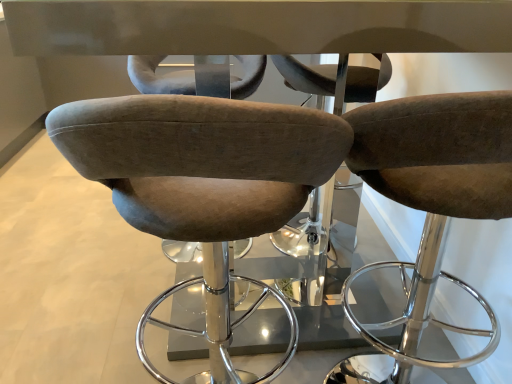
Question: Should I look upward or downward to see suede-like brown stool at center, which appears as the 1th chair when viewed from the right?

Choices:
 (A) down
 (B) up

Answer: (A)

Question: Is suede-like brown stool at center, which appears as the 1th chair when viewed from the right, shorter than velvet brown stool at center, which is the 2th chair from right to left?

Choices:
 (A) no
 (B) yes

Answer: (A)

Question: Is suede-like brown stool at center, positioned as the 2th chair in left-to-right order, not within velvet brown stool at center, which is the 2th chair from right to left?

Choices:
 (A) no
 (B) yes

Answer: (B)

Question: Is suede-like brown stool at center, positioned as the 2th chair in left-to-right order, to the left of velvet brown stool at center, the 1th chair in the left-to-right sequence, from the viewer's perspective?

Choices:
 (A) yes
 (B) no

Answer: (B)

Question: From a real-world perspective, does suede-like brown stool at center, which appears as the 1th chair when viewed from the right, stand above velvet brown stool at center, which is the 2th chair from right to left?

Choices:
 (A) no
 (B) yes

Answer: (A)

Question: Is suede-like brown stool at center, positioned as the 2th chair in left-to-right order, oriented towards velvet brown stool at center, the 1th chair in the left-to-right sequence?

Choices:
 (A) no
 (B) yes

Answer: (A)

Question: Is suede-like brown stool at center, which appears as the 1th chair when viewed from the right, positioned far away from velvet brown stool at center, which is the 2th chair from right to left?

Choices:
 (A) no
 (B) yes

Answer: (A)

Question: Considering the relative sizes of velvet brown stool at center, the 1th chair in the left-to-right sequence, and suede-like brown stool at center, which appears as the 1th chair when viewed from the right, in the image provided, is velvet brown stool at center, the 1th chair in the left-to-right sequence, thinner than suede-like brown stool at center, which appears as the 1th chair when viewed from the right,?

Choices:
 (A) yes
 (B) no

Answer: (A)

Question: Considering the relative sizes of velvet brown stool at center, which is the 2th chair from right to left, and suede-like brown stool at center, positioned as the 2th chair in left-to-right order, in the image provided, is velvet brown stool at center, which is the 2th chair from right to left, shorter than suede-like brown stool at center, positioned as the 2th chair in left-to-right order,?

Choices:
 (A) no
 (B) yes

Answer: (B)

Question: Could you tell me if velvet brown stool at center, the 1th chair in the left-to-right sequence, is facing suede-like brown stool at center, which appears as the 1th chair when viewed from the right?

Choices:
 (A) yes
 (B) no

Answer: (B)

Question: Is velvet brown stool at center, the 1th chair in the left-to-right sequence, to the left of suede-like brown stool at center, positioned as the 2th chair in left-to-right order, from the viewer's perspective?

Choices:
 (A) no
 (B) yes

Answer: (B)

Question: Can you confirm if velvet brown stool at center, which is the 2th chair from right to left, is positioned to the right of suede-like brown stool at center, which appears as the 1th chair when viewed from the right?

Choices:
 (A) no
 (B) yes

Answer: (A)

Question: Does velvet brown stool at center, the 1th chair in the left-to-right sequence, touch suede-like brown stool at center, which appears as the 1th chair when viewed from the right?

Choices:
 (A) yes
 (B) no

Answer: (B)

Question: Looking at the image, does suede-like brown stool at center, positioned as the 2th chair in left-to-right order, seem bigger or smaller compared to velvet brown stool at center, which is the 2th chair from right to left?

Choices:
 (A) small
 (B) big

Answer: (A)